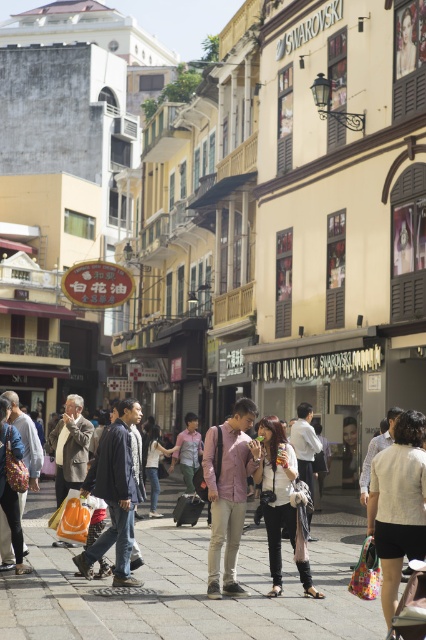
You are a fashion designer who wants to showcase a white textured shirt at center in a photo shoot. Where exactly should you position the shirt in the image?

The white textured shirt at center should be positioned at point (397, 502).

What is the color and texture of the clothing item located at the coordinates point (397,502) in the center of the image?

The clothing item at point (397,502) is a white textured shirt.